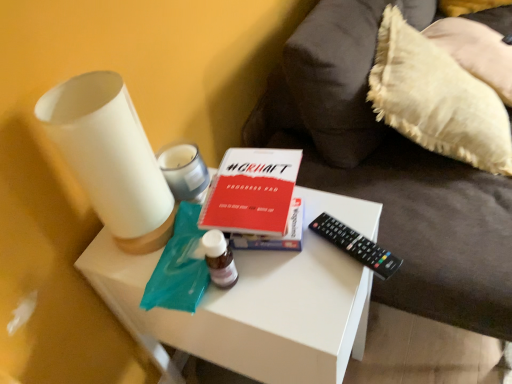
Locate an element on the screen. vacant area that is in front of red matte progress pad at center is located at coordinates (292, 289).